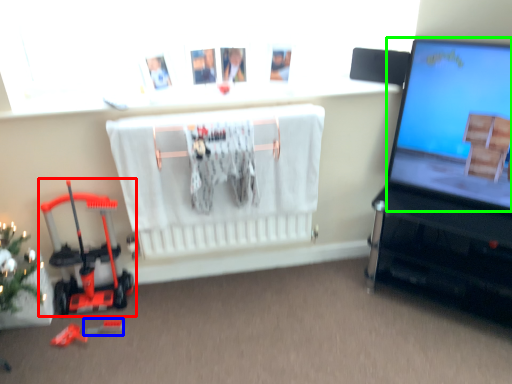
Question: Estimate the real-world distances between objects in this image. Which object is farther from toy (highlighted by a red box), toy (highlighted by a blue box) or computer screen (highlighted by a green box)?

Choices:
 (A) toy
 (B) computer screen

Answer: (B)